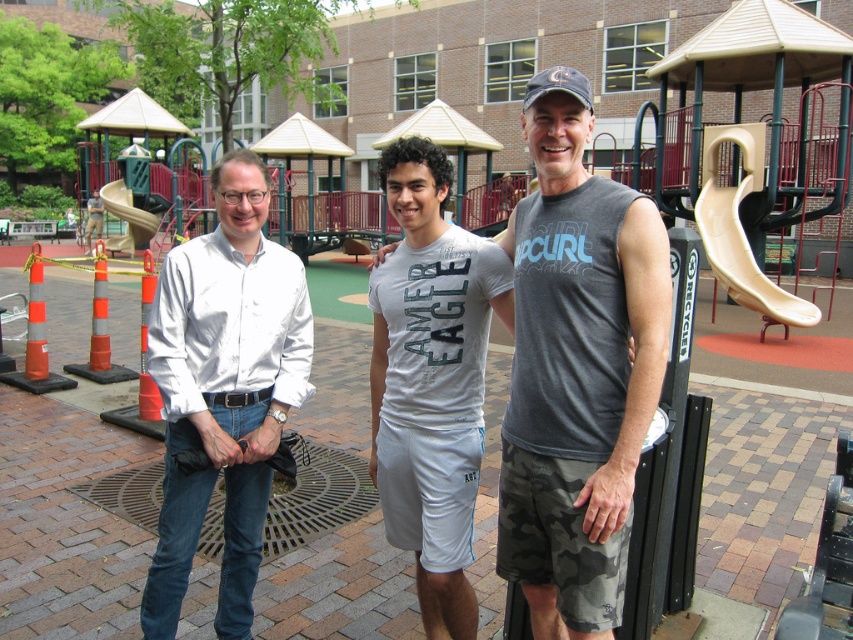
Question: Which point is farther to the camera?

Choices:
 (A) (175, 273)
 (B) (608, 572)
 (C) (401, 355)

Answer: (A)

Question: Can you confirm if gray sleeveless shirt at center is positioned below white cotton t-shirt at center?

Choices:
 (A) no
 (B) yes

Answer: (B)

Question: Which of these objects is positioned farthest from the white glossy shirt at center?

Choices:
 (A) white cotton t-shirt at center
 (B) gray sleeveless shirt at center

Answer: (B)

Question: Can you confirm if gray sleeveless shirt at center is positioned to the left of white glossy shirt at center?

Choices:
 (A) yes
 (B) no

Answer: (B)

Question: Which object is the farthest from the white glossy shirt at center?

Choices:
 (A) gray sleeveless shirt at center
 (B) white cotton t-shirt at center

Answer: (A)

Question: Can you confirm if gray sleeveless shirt at center is bigger than white glossy shirt at center?

Choices:
 (A) yes
 (B) no

Answer: (B)